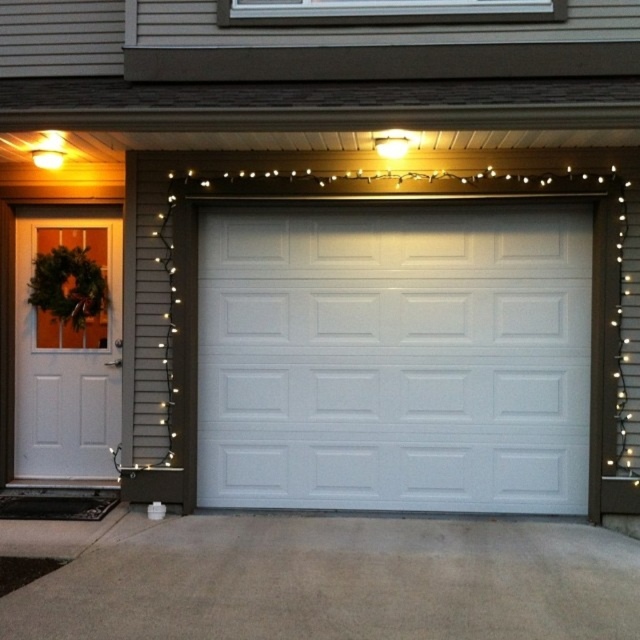
You are a delivery person trying to deliver a package to the residential building. You notice the white painted wood garage door at center and the matte yellow light bulb at upper left. Which object is taller?

The white painted wood garage door at center is taller than the matte yellow light bulb at upper left.

You are a delivery person approaching the residential building. You need to park your van on the gray concrete driveway at lower center. Considering the height of the white painted wood garage door at center, will your van fit under it?

The white painted wood garage door at center has a greater height compared to the gray concrete driveway at lower center. Therefore, the van should fit under the garage door as the door is taller than the driveway surface.